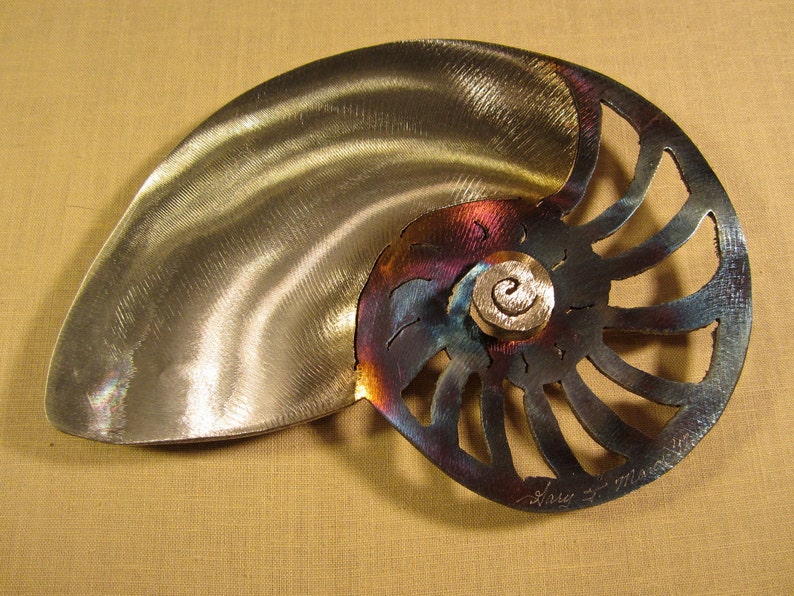
Image resolution: width=794 pixels, height=596 pixels. Identify the location of sculpture. (538, 231).